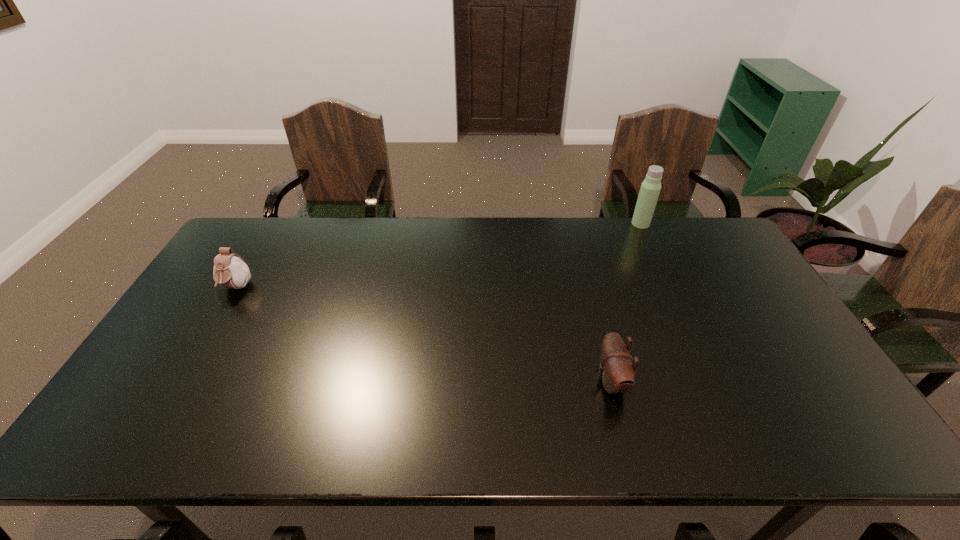
I want to click on the rightmost object, so click(x=650, y=189).

Locate an element on the screen. the farthest object is located at coordinates (650, 189).

Where is `the farther pouch`? The image size is (960, 540). the farther pouch is located at coordinates (230, 270).

The width and height of the screenshot is (960, 540). I want to click on the second nearest object, so click(230, 270).

This screenshot has width=960, height=540. Identify the location of the second object from right to left. (617, 372).

You are a GUI agent. You are given a task and a screenshot of the screen. Output one action in this format:
    pyautogui.click(x=<x>, y=<y>)
    Task: Click on the nearer pouch
    The width and height of the screenshot is (960, 540).
    Given the screenshot: What is the action you would take?
    pyautogui.click(x=617, y=372)

This screenshot has width=960, height=540. In order to click on vacant area situated 0.260m on the left of the thermos bottle in this screenshot , I will do `click(561, 224)`.

I want to click on blank space located 0.200m on the front-facing side of the leftmost object, so click(196, 356).

The image size is (960, 540). I want to click on vacant space located with the flap open on the nearest object, so click(484, 381).

Where is `free region located 0.370m with the flap open on the nearest object`? The image size is (960, 540). free region located 0.370m with the flap open on the nearest object is located at coordinates (448, 381).